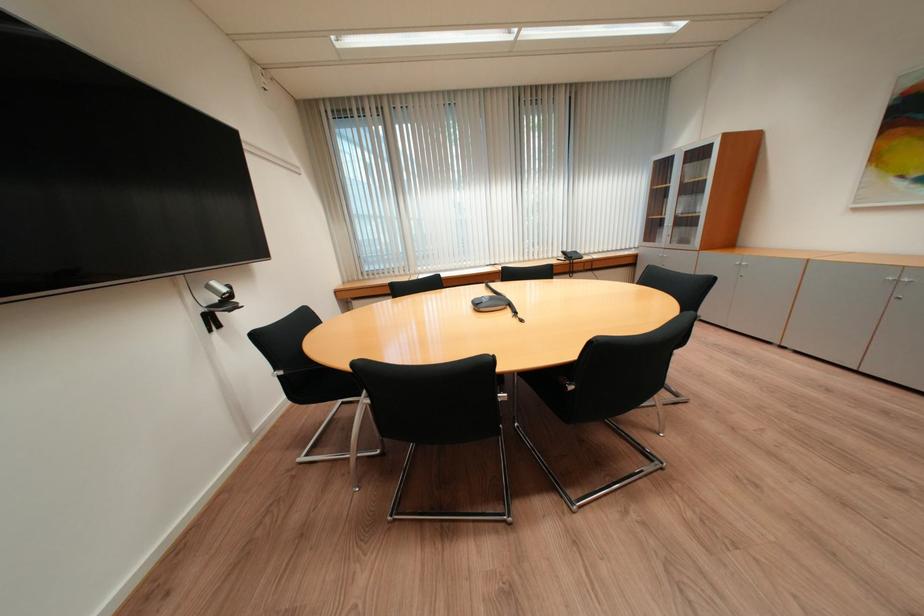
Which object does [220,290] point to?

It refers to a silver web camera.